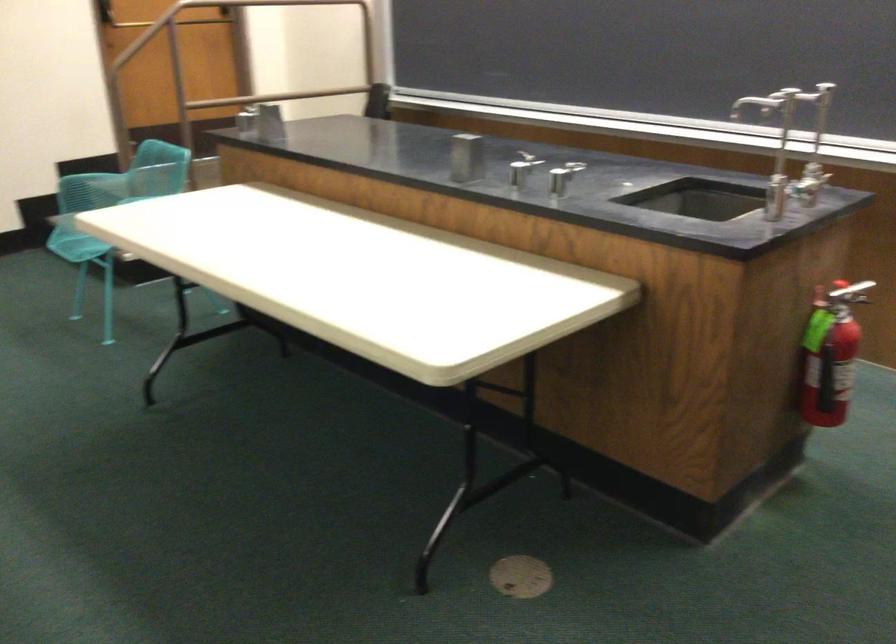
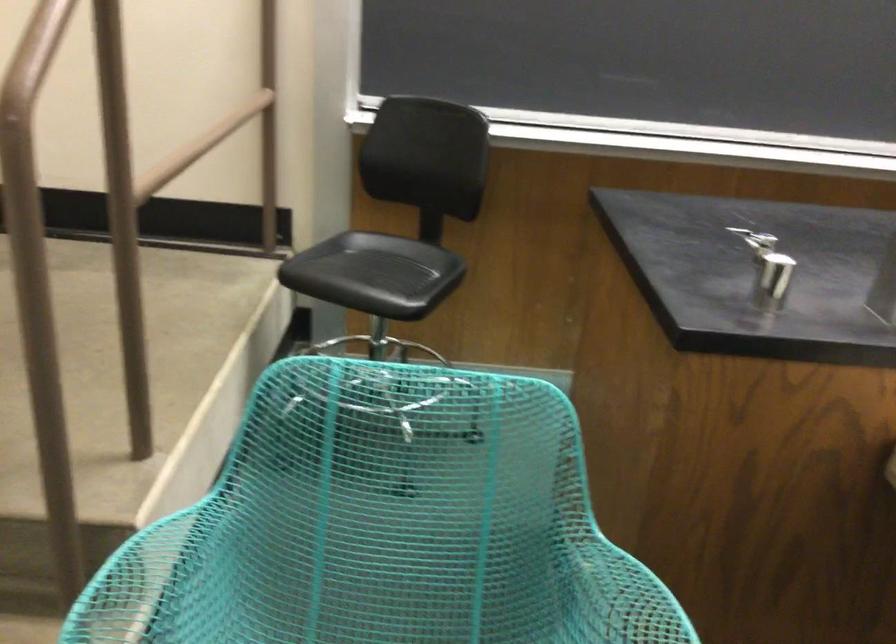
Locate, in the second image, the point that corresponds to the point at 92,178 in the first image.

(150, 582)